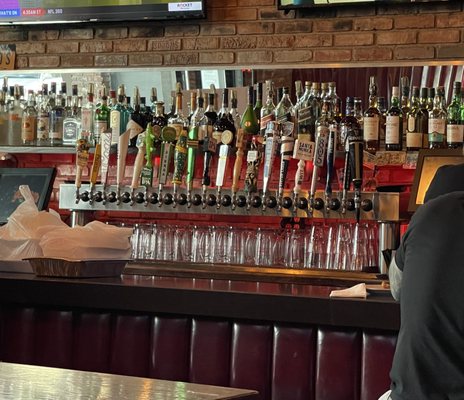
You are a GUI agent. You are given a task and a screenshot of the screen. Output one action in this format:
    pyautogui.click(x=<x>, y=<y>)
    Task: Click on the looks like a tv screen
    
    Given the screenshot: What is the action you would take?
    pyautogui.click(x=103, y=14)